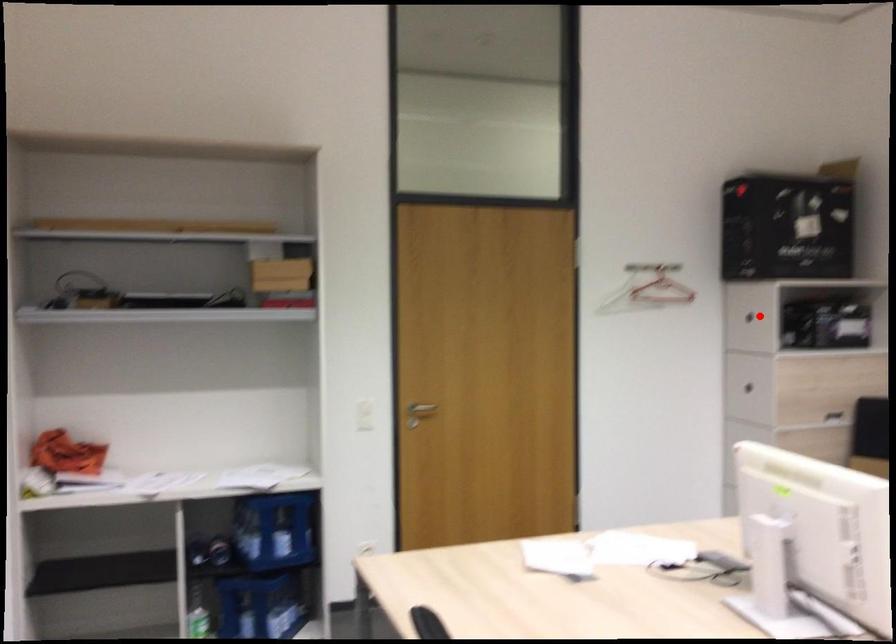
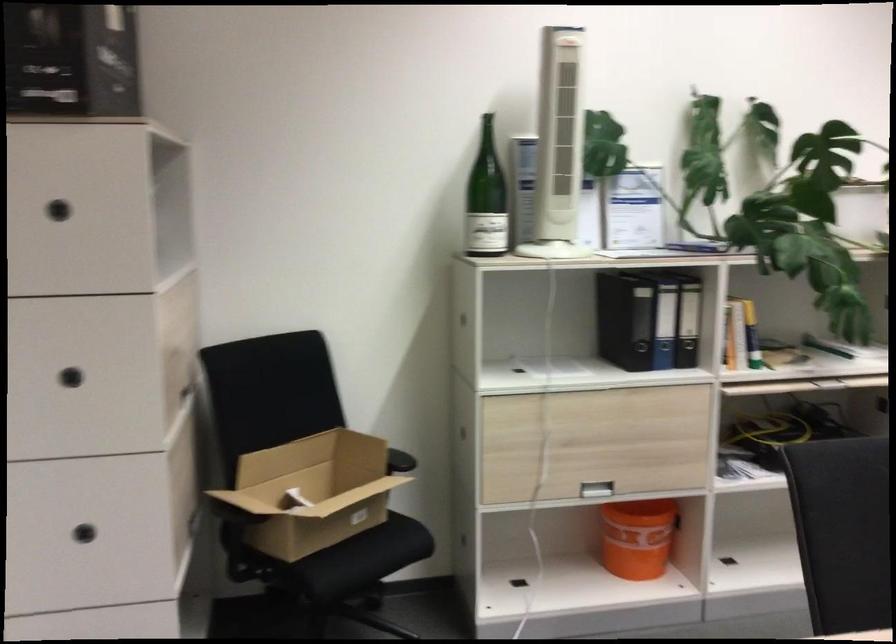
The point at the highlighted location is marked in the first image. Where is the corresponding point in the second image?

(59, 210)